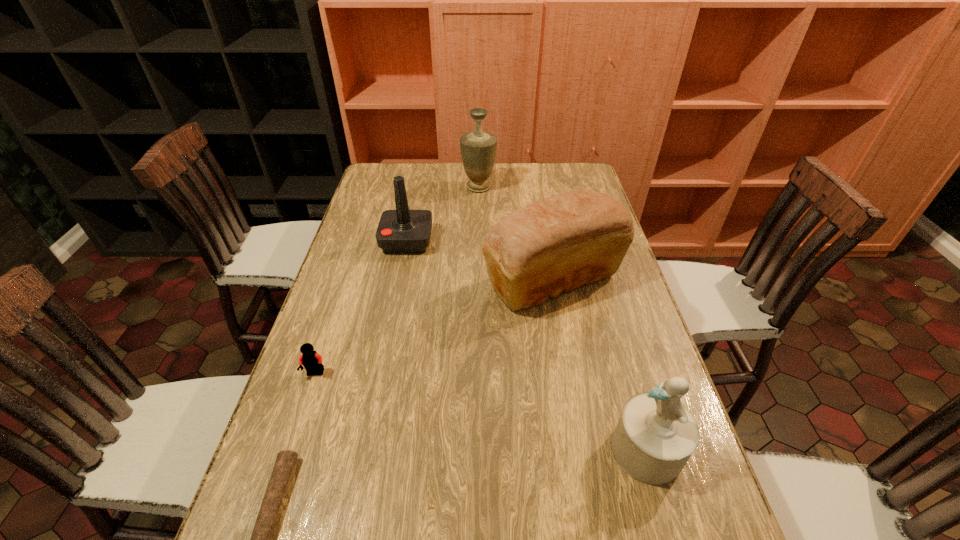
Locate which object ranks second in proximity to the farthest object. Please provide its 2D coordinates. Your answer should be formatted as a tuple, i.e. [(x, y)], where the tuple contains the x and y coordinates of a point satisfying the conditions above.

[(560, 243)]